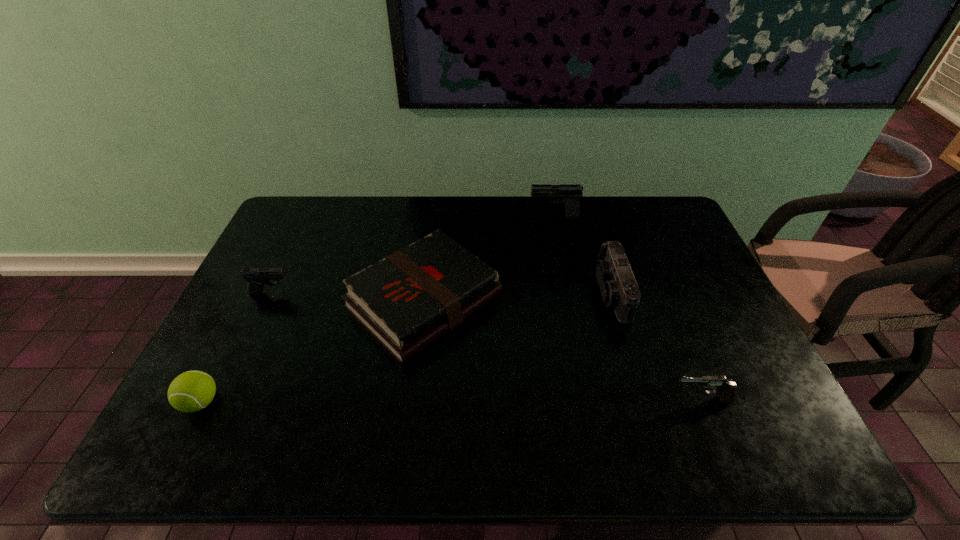
Where is `free space located aim along the barrel of the second pistol from left to right`? This screenshot has width=960, height=540. free space located aim along the barrel of the second pistol from left to right is located at coordinates (466, 217).

At what (x,y) coordinates should I click in order to perform the action: click on free space located 0.200m on the front-facing side of the camcorder. Please return your answer as a coordinate pair (x, y). The height and width of the screenshot is (540, 960). Looking at the image, I should click on (527, 293).

Find the location of a particular element. vacant position located 0.340m on the front-facing side of the camcorder is located at coordinates (479, 293).

This screenshot has width=960, height=540. What are the coordinates of `free space located 0.240m on the front-facing side of the camcorder` in the screenshot? It's located at [514, 293].

Where is `free space located 0.120m on the left of the fourth object from right to left`? The width and height of the screenshot is (960, 540). free space located 0.120m on the left of the fourth object from right to left is located at coordinates (303, 301).

Identify the location of blank space located 0.300m at the barrel of the rightmost object. This screenshot has height=540, width=960. (540, 400).

What are the coordinates of `vacant area situated 0.360m at the barrel of the rightmost object` in the screenshot? It's located at (515, 400).

At what (x,y) coordinates should I click in order to perform the action: click on vacant space located at the barrel of the rightmost object. Please return your answer as a coordinate pair (x, y). The image size is (960, 540). Looking at the image, I should click on (648, 400).

At what (x,y) coordinates should I click in order to perform the action: click on vacant space positioned 0.050m at the barrel of the second nearest pistol. Please return your answer as a coordinate pair (x, y). The width and height of the screenshot is (960, 540). Looking at the image, I should click on (310, 292).

I want to click on free space located on the back of the tennis ball, so click(x=252, y=302).